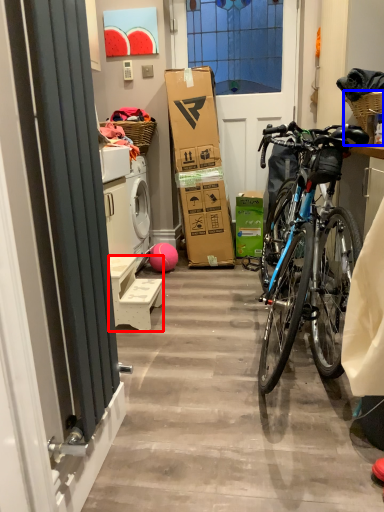
Question: Which of the following is the farthest to the observer, furniture (highlighted by a red box) or picnic basket (highlighted by a blue box)?

Choices:
 (A) furniture
 (B) picnic basket

Answer: (A)